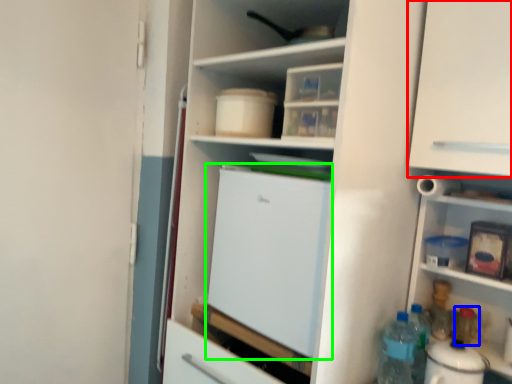
Question: Estimate the real-world distances between objects in this image. Which object is farther from cabinetry (highlighted by a red box), bottle (highlighted by a blue box) or refrigerator (highlighted by a green box)?

Choices:
 (A) bottle
 (B) refrigerator

Answer: (A)